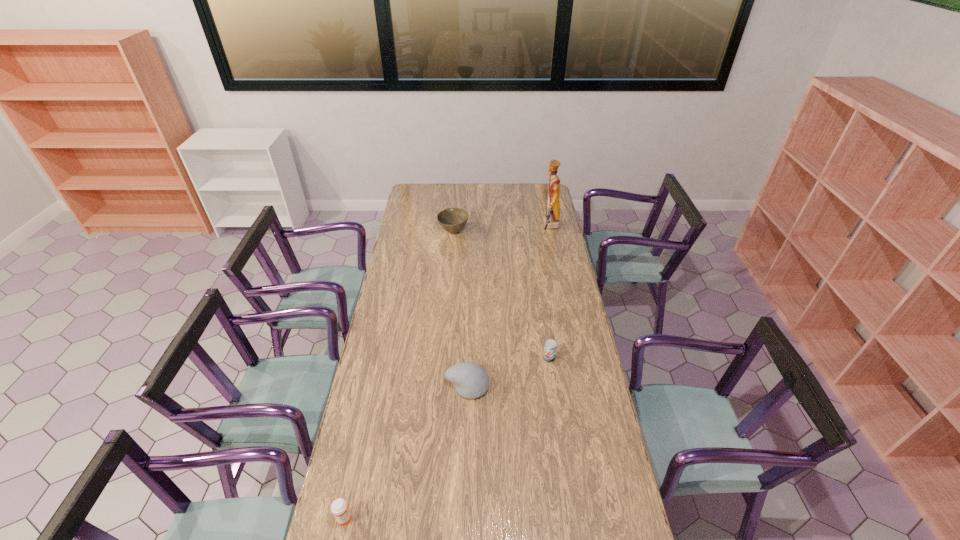
This screenshot has height=540, width=960. I want to click on free space between the beer can and the fourth farthest object, so click(508, 372).

Locate an element on the screen. This screenshot has width=960, height=540. vacant area that lies between the nearest object and the bowl is located at coordinates (399, 375).

You are a GUI agent. You are given a task and a screenshot of the screen. Output one action in this format:
    pyautogui.click(x=<x>, y=<y>)
    Task: Click on the vacant area between the beanie and the beer can
    The image size is (960, 540).
    Given the screenshot: What is the action you would take?
    pyautogui.click(x=508, y=372)

At what (x,y) coordinates should I click in order to perform the action: click on vacant area that lies between the second object from right to left and the bowl. Please return your answer as a coordinate pair (x, y). Looking at the image, I should click on (501, 295).

Where is `vacant area that lies between the beer can and the beanie`? Image resolution: width=960 pixels, height=540 pixels. vacant area that lies between the beer can and the beanie is located at coordinates (508, 372).

Where is `object that is the fourth closest to the bowl`? This screenshot has height=540, width=960. object that is the fourth closest to the bowl is located at coordinates (340, 508).

This screenshot has width=960, height=540. I want to click on the fourth closest object to the tallest object, so click(340, 508).

You are a GUI agent. You are given a task and a screenshot of the screen. Output one action in this format:
    pyautogui.click(x=<x>, y=<y>)
    Task: Click on the free space that satisfies the following two spatial constraints: 1. on the front-facing side of the nutcracker; 2. on the front side of the fourth farthest object
    
    Given the screenshot: What is the action you would take?
    pyautogui.click(x=583, y=386)